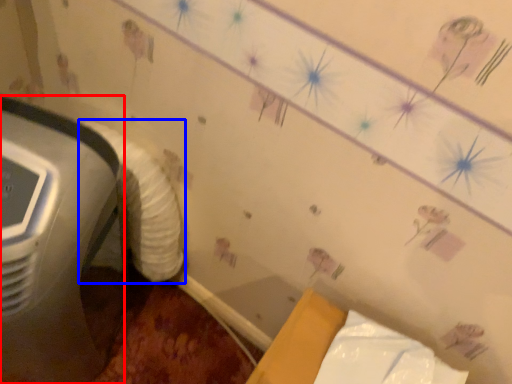
Question: Which object is further to the camera taking this photo, home appliance (highlighted by a red box) or sheet (highlighted by a blue box)?

Choices:
 (A) home appliance
 (B) sheet

Answer: (B)